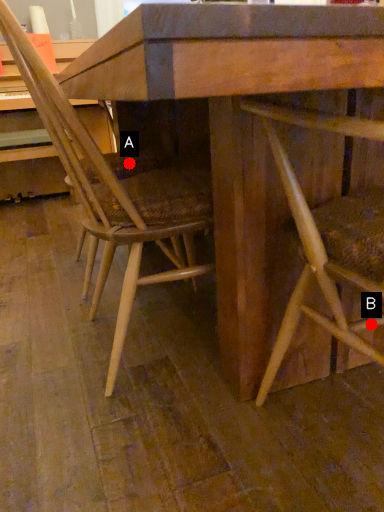
Question: Two points are circled on the image, labeled by A and B beside each circle. Which point is closer to the camera taking this photo?

Choices:
 (A) A is closer
 (B) B is closer

Answer: (B)